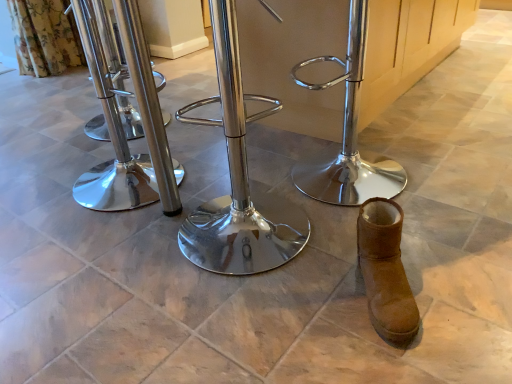
Identify the location of vacant space situated on the left part of brown suede boot at lower right. (310, 302).